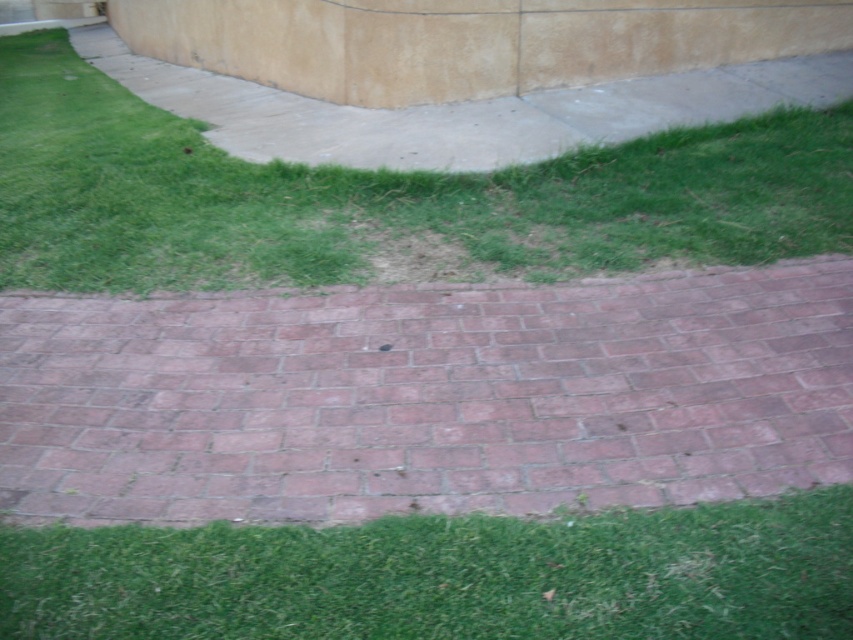
You are a gardener who needs to trim the grass. You see two areas of green grass at center and green grass at lower center. Which area requires more trimming based on their current height?

The green grass at center requires more trimming because it is shorter than the green grass at lower center, which is taller and needs more attention.

You are standing on the paved area and want to place a small potted plant between the red brick at center and the green grass at center. Based on their positions, which object should the plant be closer to?

The red brick at center is closer to the viewer than the green grass at center, so the plant should be placed closer to the red brick at center to maintain the spatial relationship between the two objects.